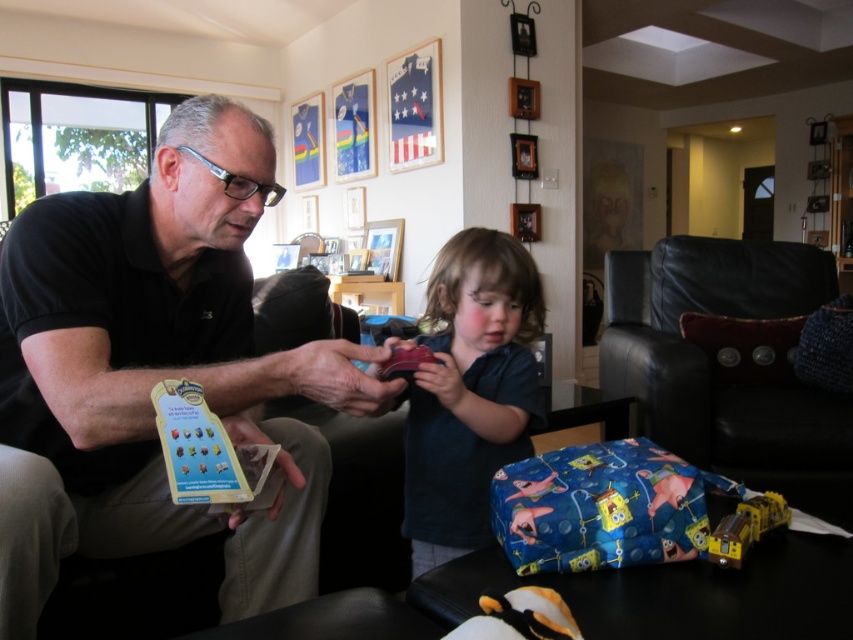
Question: Does matte black shirt at left have a lesser width compared to black leather armchair at right?

Choices:
 (A) no
 (B) yes

Answer: (B)

Question: From the image, what is the correct spatial relationship of dark blue shirt at center in relation to rubberized plastic toy at center?

Choices:
 (A) right
 (B) left

Answer: (A)

Question: Which point is farther to the camera?

Choices:
 (A) (386, 376)
 (B) (190, 312)
 (C) (769, 515)

Answer: (A)

Question: Which point is farther to the camera?

Choices:
 (A) (x=431, y=353)
 (B) (x=479, y=538)
 (C) (x=775, y=515)
 (D) (x=158, y=532)

Answer: (B)

Question: From the image, what is the correct spatial relationship of matte black shirt at left in relation to rubberized plastic toy at center?

Choices:
 (A) below
 (B) above

Answer: (A)

Question: Which object is closer to the camera taking this photo?

Choices:
 (A) rubberized plastic toy at center
 (B) matte black shirt at left
 (C) dark blue shirt at center
 (D) black leather armchair at right

Answer: (B)